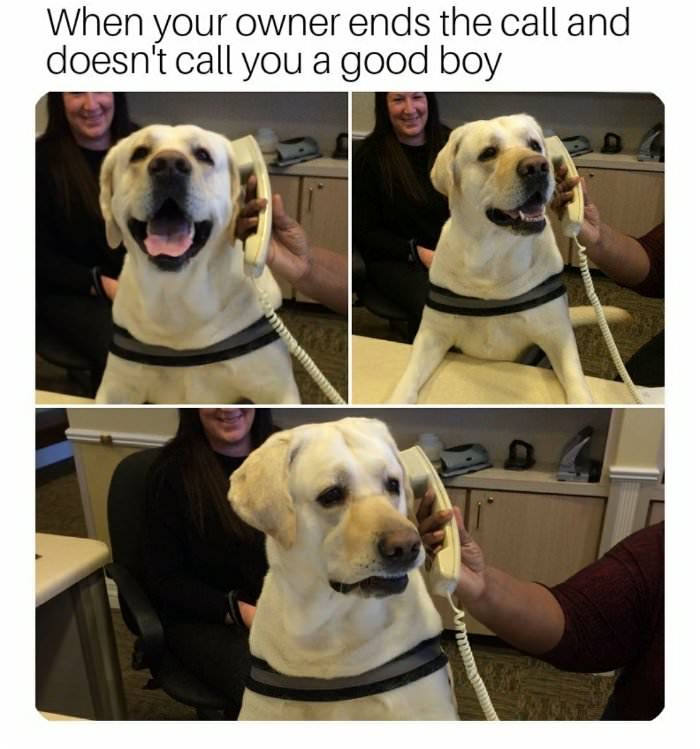
This screenshot has width=700, height=749. Find the location of `phone cord`. phone cord is located at coordinates (480, 694).